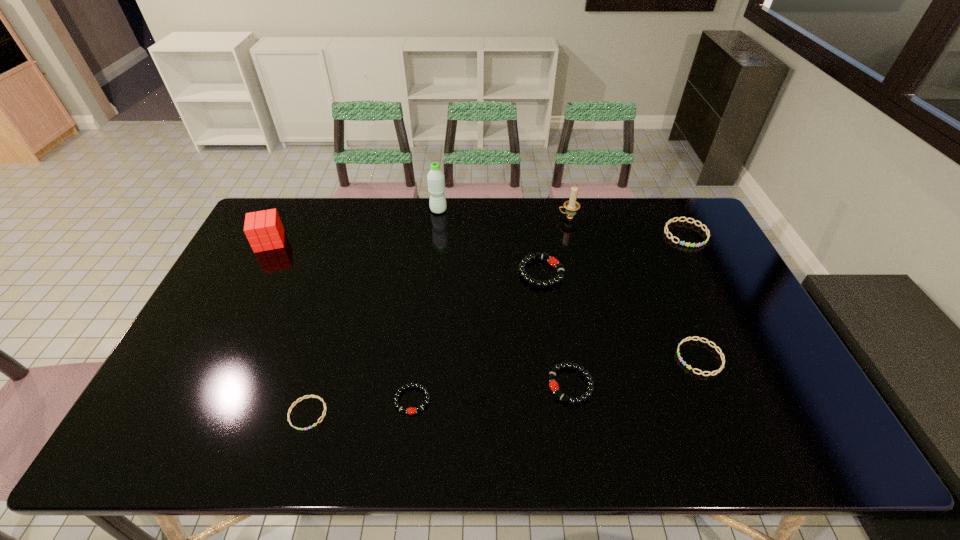
You are a GUI agent. You are given a task and a screenshot of the screen. Output one action in this format:
    pyautogui.click(x=<x>, y=<y>)
    Task: Click on the second farthest blue bracelet
    Image resolution: width=960 pixels, height=540 pixels.
    Given the screenshot: What is the action you would take?
    pyautogui.click(x=691, y=338)

The image size is (960, 540). I want to click on the fifth bracelet from right to left, so click(411, 410).

In order to click on the smallest black bracelet in this screenshot , I will do [411, 410].

Locate an element on the screen. the shortest bracelet is located at coordinates (309, 396).

The image size is (960, 540). I want to click on the smallest blue bracelet, so click(x=309, y=396).

You are a GUI agent. You are given a task and a screenshot of the screen. Output one action in this format:
    pyautogui.click(x=<x>, y=<y>)
    Task: Click on the vacant space located 0.370m on the left of the green water bottle
    
    Given the screenshot: What is the action you would take?
    pyautogui.click(x=330, y=211)

At what (x,y) coordinates should I click in order to perform the action: click on vacant area located on the handle side of the eighth shortest object. Please return your answer as a coordinate pair (x, y). The height and width of the screenshot is (540, 960). Looking at the image, I should click on (469, 217).

Find the location of a particular element. This screenshot has height=540, width=960. free region located on the handle side of the eighth shortest object is located at coordinates (541, 217).

Locate an element on the screen. The width and height of the screenshot is (960, 540). vacant region located on the handle side of the eighth shortest object is located at coordinates (484, 217).

Image resolution: width=960 pixels, height=540 pixels. I want to click on vacant region located on the right of the red cube, so click(x=334, y=241).